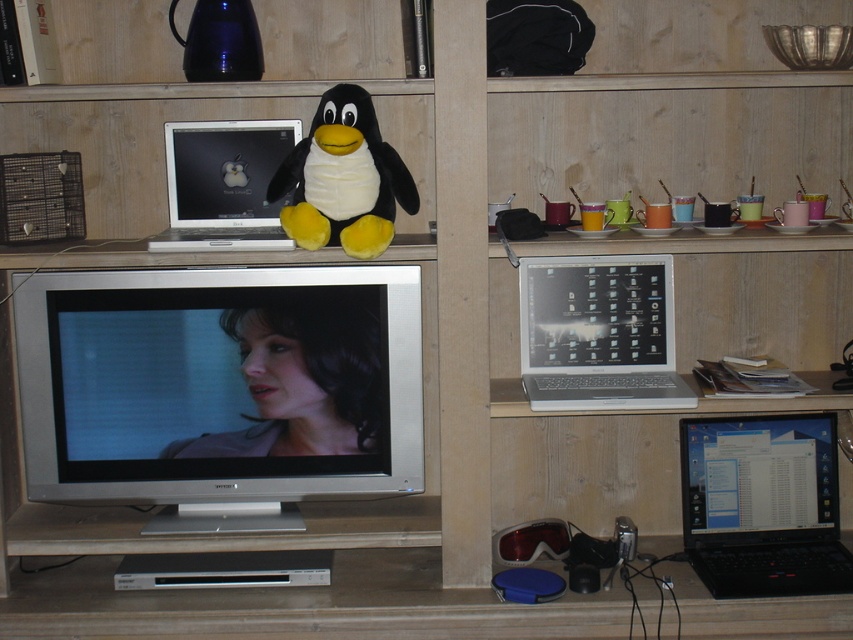
In the scene shown: You are organizing the middle shelf of the wooden shelving unit. You need to place a new decorative item between the silver metallic television at center and the smooth skin face at center. Where should you place it to ensure it is between them?

Place the new decorative item between the silver metallic television at center and the smooth skin face at center, positioning it to the right of the television and to the left of the face since the television is to the left of the face.